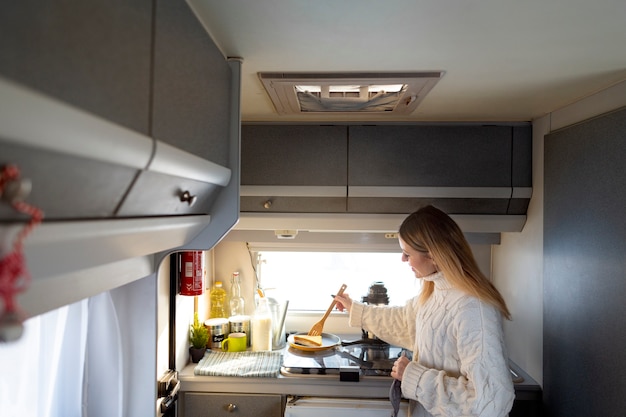
You are a GUI agent. You are given a task and a screenshot of the screen. Output one action in this format:
    pyautogui.click(x=<x>, y=<y>)
    Task: Click on the door
    The width and height of the screenshot is (626, 417).
    Given the screenshot: What is the action you would take?
    pyautogui.click(x=578, y=314)